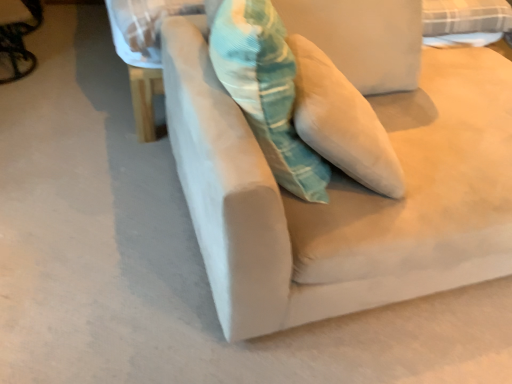
Question: Looking at their shapes, would you say suede beige couch at center is wider or thinner than textured teal pillow at center?

Choices:
 (A) thin
 (B) wide

Answer: (B)

Question: Do you think suede beige couch at center is within textured teal pillow at center, or outside of it?

Choices:
 (A) outside
 (B) inside

Answer: (A)

Question: Estimate the real-world distances between objects in this image. Which object is closer to the metallic silver swivel chair at left?

Choices:
 (A) textured teal pillow at center
 (B) suede beige couch at center

Answer: (A)

Question: Based on their relative distances, which object is nearer to the textured teal pillow at center?

Choices:
 (A) metallic silver swivel chair at left
 (B) suede beige couch at center

Answer: (B)